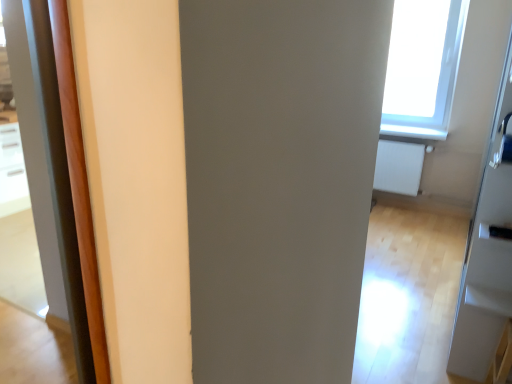
This screenshot has width=512, height=384. What do you see at coordinates (495, 232) in the screenshot?
I see `black plastic door handle at lower right, the 1th door handle in the bottom-to-top sequence` at bounding box center [495, 232].

This screenshot has height=384, width=512. Identify the location of satin silver door handle at right, which appears as the 1th door handle when viewed from the top. (503, 143).

In order to face transparent glass screen door at upper right, should I rotate leftwards or rightwards?

A 30.646 degree turn to the right will do.

Where is `black plastic door handle at lower right, the 1th door handle in the bottom-to-top sequence`? The height and width of the screenshot is (384, 512). black plastic door handle at lower right, the 1th door handle in the bottom-to-top sequence is located at coordinates (495, 232).

Considering the positions of point (511, 112) and point (500, 294), is point (511, 112) closer or farther from the camera than point (500, 294)?

Point (511, 112).

Considering the positions of objects satin silver door handle at right, which appears as the 1th door handle when viewed from the top, and transparent glass screen door at upper right in the image provided, who is behind, satin silver door handle at right, which appears as the 1th door handle when viewed from the top, or transparent glass screen door at upper right?

Positioned behind is satin silver door handle at right, which appears as the 1th door handle when viewed from the top.

From the picture: Is satin silver door handle at right, the second door handle ordered from the bottom, touching transparent glass screen door at upper right?

No, satin silver door handle at right, the second door handle ordered from the bottom, is not next to transparent glass screen door at upper right.

Is satin silver door handle at right, which appears as the 1th door handle when viewed from the top, to the left of transparent glass screen door at upper right from the viewer's perspective?

Incorrect, satin silver door handle at right, which appears as the 1th door handle when viewed from the top, is not on the left side of transparent glass screen door at upper right.

Would you say white matte radiator at right is inside or outside satin silver door handle at right, the second door handle ordered from the bottom?

white matte radiator at right is located beyond the bounds of satin silver door handle at right, the second door handle ordered from the bottom.

Is white matte radiator at right far away from satin silver door handle at right, which appears as the 1th door handle when viewed from the top?

No, white matte radiator at right is not far from satin silver door handle at right, which appears as the 1th door handle when viewed from the top.

Is white matte radiator at right positioned with its back to satin silver door handle at right, which appears as the 1th door handle when viewed from the top?

No, white matte radiator at right is not facing the opposite direction of satin silver door handle at right, which appears as the 1th door handle when viewed from the top.

In the scene shown: Considering the sizes of objects white matte radiator at right and satin silver door handle at right, the second door handle ordered from the bottom, in the image provided, who is bigger, white matte radiator at right or satin silver door handle at right, the second door handle ordered from the bottom,?

white matte radiator at right.

How much distance is there between black plastic door handle at lower right, the 1th door handle in the bottom-to-top sequence, and satin silver door handle at right, which appears as the 1th door handle when viewed from the top?

They are 1.93 meters apart.

From a real-world perspective, between black plastic door handle at lower right, the second door handle viewed from the top, and satin silver door handle at right, the second door handle ordered from the bottom, who is vertically higher?

From a 3D spatial view, satin silver door handle at right, the second door handle ordered from the bottom, is above.

Where is `door handle above the black plastic door handle at lower right, the 1th door handle in the bottom-to-top sequence (from a real-world perspective)`? The width and height of the screenshot is (512, 384). door handle above the black plastic door handle at lower right, the 1th door handle in the bottom-to-top sequence (from a real-world perspective) is located at coordinates (503, 143).

Does black plastic door handle at lower right, the second door handle viewed from the top, have a smaller size compared to satin silver door handle at right, which appears as the 1th door handle when viewed from the top?

Indeed, black plastic door handle at lower right, the second door handle viewed from the top, has a smaller size compared to satin silver door handle at right, which appears as the 1th door handle when viewed from the top.

Is point (388, 189) farther from viewer compared to point (461, 329)?

Yes, point (388, 189) is farther from viewer.

Which object is further away from the camera taking this photo, white matte radiator at right or transparent glass screen door at upper right?

Positioned behind is white matte radiator at right.

Considering the relative positions of white matte radiator at right and transparent glass screen door at upper right in the image provided, is white matte radiator at right to the left of transparent glass screen door at upper right from the viewer's perspective?

Incorrect, white matte radiator at right is not on the left side of transparent glass screen door at upper right.

Which of these two, white matte radiator at right or transparent glass screen door at upper right, is smaller?

transparent glass screen door at upper right.

Looking at this image, between transparent glass screen door at upper right and white matte radiator at right, which one has less height?

white matte radiator at right.

Based on the photo, which object is wider, transparent glass screen door at upper right or white matte radiator at right?

With larger width is white matte radiator at right.

Identify the location of screen door below the white matte radiator at right (from the image's perspective). The height and width of the screenshot is (384, 512). (487, 251).

Considering the points (461, 351) and (415, 156), which point is in front, point (461, 351) or point (415, 156)?

The point (461, 351) is in front.

Measure the distance between transparent glass screen door at upper right and black plastic door handle at lower right, the second door handle viewed from the top.

transparent glass screen door at upper right is 10.40 inches away from black plastic door handle at lower right, the second door handle viewed from the top.

Which of these two, transparent glass screen door at upper right or black plastic door handle at lower right, the second door handle viewed from the top, is smaller?

Smaller between the two is black plastic door handle at lower right, the second door handle viewed from the top.

Is transparent glass screen door at upper right far away from black plastic door handle at lower right, the second door handle viewed from the top?

No, there isn't a large distance between transparent glass screen door at upper right and black plastic door handle at lower right, the second door handle viewed from the top.

Where is `the 2nd door handle behind the transparent glass screen door at upper right`? the 2nd door handle behind the transparent glass screen door at upper right is located at coordinates (495, 232).

Is black plastic door handle at lower right, the second door handle viewed from the top, far from transparent glass screen door at upper right?

No.

Is black plastic door handle at lower right, the second door handle viewed from the top, smaller than transparent glass screen door at upper right?

Yes.

Considering the points (484, 236) and (476, 211), which point is in front, point (484, 236) or point (476, 211)?

Point (484, 236)

In the scene shown: Is transparent glass screen door at upper right at the back of black plastic door handle at lower right, the 1th door handle in the bottom-to-top sequence?

Yes.

You are a GUI agent. You are given a task and a screenshot of the screen. Output one action in this format:
    pyautogui.click(x=<x>, y=<y>)
    Task: Click on the door handle located above the transparent glass screen door at upper right (from a real-world perspective)
    
    Given the screenshot: What is the action you would take?
    pyautogui.click(x=503, y=143)

Identify the location of radiator below the satin silver door handle at right, the second door handle ordered from the bottom (from a real-world perspective). point(398,167).

Looking at the image, which one is located closer to white matte radiator at right, satin silver door handle at right, which appears as the 1th door handle when viewed from the top, or transparent glass screen door at upper right?

satin silver door handle at right, which appears as the 1th door handle when viewed from the top, is closer to white matte radiator at right.

Based on their spatial positions, is black plastic door handle at lower right, the second door handle viewed from the top, or transparent glass screen door at upper right closer to satin silver door handle at right, which appears as the 1th door handle when viewed from the top?

Based on the image, transparent glass screen door at upper right appears to be nearer to satin silver door handle at right, which appears as the 1th door handle when viewed from the top.

Which object lies nearer to the anchor point satin silver door handle at right, which appears as the 1th door handle when viewed from the top, transparent glass screen door at upper right or white matte radiator at right?

Based on the image, white matte radiator at right appears to be nearer to satin silver door handle at right, which appears as the 1th door handle when viewed from the top.

When comparing their distances from black plastic door handle at lower right, the second door handle viewed from the top, does transparent glass screen door at upper right or satin silver door handle at right, which appears as the 1th door handle when viewed from the top, seem closer?

Based on the image, transparent glass screen door at upper right appears to be nearer to black plastic door handle at lower right, the second door handle viewed from the top.

Considering their positions, is satin silver door handle at right, the second door handle ordered from the bottom, positioned further to black plastic door handle at lower right, the 1th door handle in the bottom-to-top sequence, than white matte radiator at right?

white matte radiator at right is further to black plastic door handle at lower right, the 1th door handle in the bottom-to-top sequence.

Which object lies nearer to the anchor point white matte radiator at right, black plastic door handle at lower right, the 1th door handle in the bottom-to-top sequence, or satin silver door handle at right, which appears as the 1th door handle when viewed from the top?

satin silver door handle at right, which appears as the 1th door handle when viewed from the top, lies closer to white matte radiator at right than the other object.

Estimate the real-world distances between objects in this image. Which object is closer to transparent glass screen door at upper right, black plastic door handle at lower right, the 1th door handle in the bottom-to-top sequence, or satin silver door handle at right, which appears as the 1th door handle when viewed from the top?

black plastic door handle at lower right, the 1th door handle in the bottom-to-top sequence.

Based on the photo, considering their positions, is transparent glass screen door at upper right positioned further to black plastic door handle at lower right, the second door handle viewed from the top, than white matte radiator at right?

Among the two, white matte radiator at right is located further to black plastic door handle at lower right, the second door handle viewed from the top.

Where is `screen door that lies between satin silver door handle at right, which appears as the 1th door handle when viewed from the top, and black plastic door handle at lower right, the second door handle viewed from the top, from top to bottom`? screen door that lies between satin silver door handle at right, which appears as the 1th door handle when viewed from the top, and black plastic door handle at lower right, the second door handle viewed from the top, from top to bottom is located at coordinates (487, 251).

At what (x,y) coordinates should I click in order to perform the action: click on door handle located between satin silver door handle at right, which appears as the 1th door handle when viewed from the top, and white matte radiator at right in the depth direction. Please return your answer as a coordinate pair (x, y). Looking at the image, I should click on (495, 232).